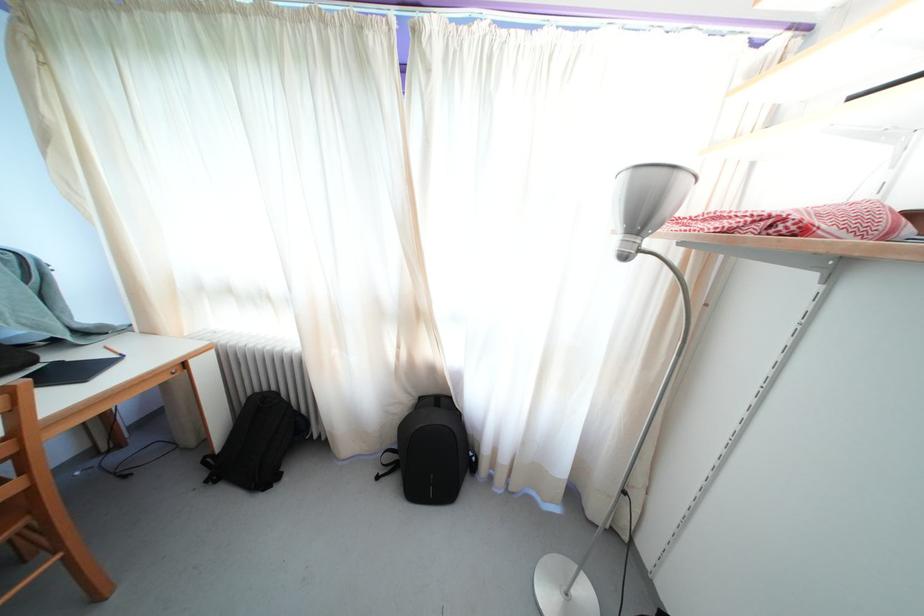
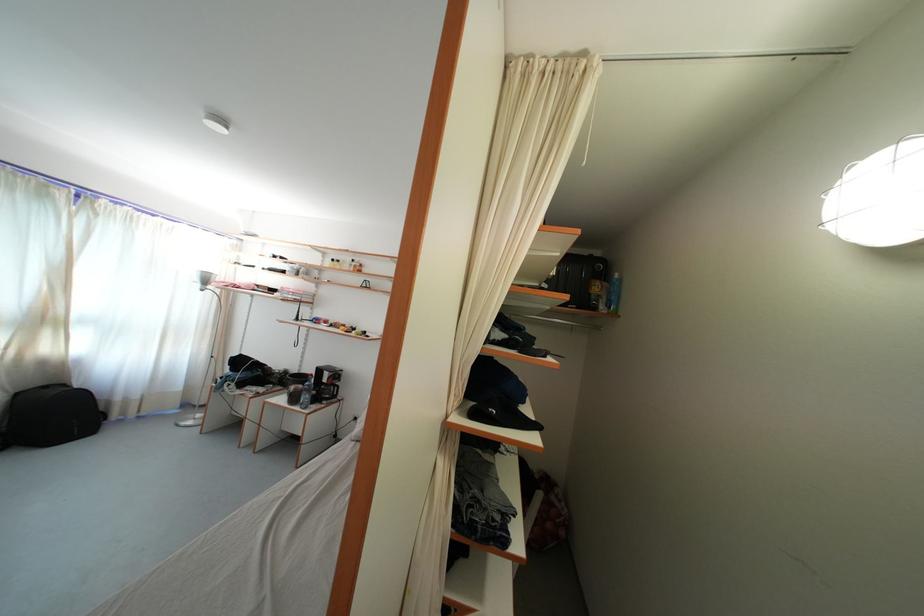
Locate, in the second image, the point that corresponds to [421,321] in the first image.

(52, 326)